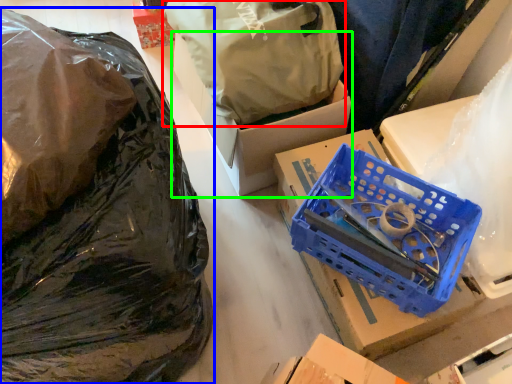
Question: Which is farther away from plastic bag (highlighted by a red box)? plastic bag (highlighted by a blue box) or box (highlighted by a green box)?

Choices:
 (A) plastic bag
 (B) box

Answer: (A)